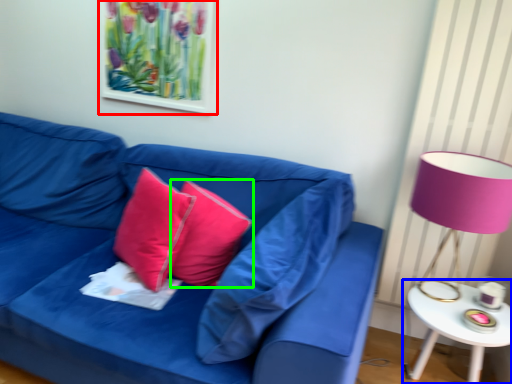
Question: Considering the real-world distances, which object is farthest from picture frame (highlighted by a red box)? table (highlighted by a blue box) or pillow (highlighted by a green box)?

Choices:
 (A) table
 (B) pillow

Answer: (A)